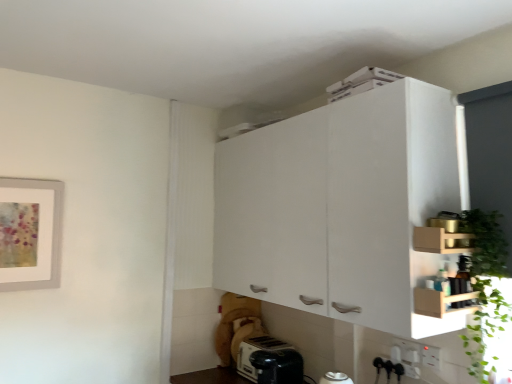
Question: Which direction should I rotate to face white matte cabinet at upper center, the first cabinetry positioned from the back, — up or down?

Choices:
 (A) down
 (B) up

Answer: (A)

Question: Is the depth of white plastic electric outlet at lower right, which appears as the 1th electric outlet when viewed from the back, less than that of wooden shelf at upper right, which is the 2th cabinetry from back to front?

Choices:
 (A) no
 (B) yes

Answer: (A)

Question: Can you confirm if white plastic electric outlet at lower right, which appears as the 1th electric outlet when viewed from the back, is smaller than wooden shelf at upper right, which is the 2th cabinetry from back to front?

Choices:
 (A) no
 (B) yes

Answer: (B)

Question: Considering the relative sizes of white plastic electric outlet at lower right, which ranks as the 2th electric outlet in right-to-left order, and wooden shelf at upper right, which is the 2th cabinetry from back to front, in the image provided, is white plastic electric outlet at lower right, which ranks as the 2th electric outlet in right-to-left order, bigger than wooden shelf at upper right, which is the 2th cabinetry from back to front,?

Choices:
 (A) no
 (B) yes

Answer: (A)

Question: From a real-world perspective, is white plastic electric outlet at lower right, which is the 2th electric outlet from front to back, over wooden shelf at upper right, arranged as the 1th cabinetry when viewed from the front?

Choices:
 (A) no
 (B) yes

Answer: (A)

Question: Does white plastic electric outlet at lower right, acting as the 1th electric outlet starting from the left, have a greater width compared to wooden shelf at upper right, which is the 2th cabinetry from back to front?

Choices:
 (A) no
 (B) yes

Answer: (A)

Question: Is white plastic electric outlet at lower right, which is the 2th electric outlet from front to back, outside of wooden shelf at upper right, arranged as the 1th cabinetry when viewed from the front?

Choices:
 (A) yes
 (B) no

Answer: (A)

Question: Is white plastic electric outlet at lower right, positioned as the second electric outlet in back-to-front order, far from white matte cabinet at upper center, which is the 2th cabinetry in front-to-back order?

Choices:
 (A) yes
 (B) no

Answer: (B)

Question: From a real-world perspective, is white plastic electric outlet at lower right, the 1th electric outlet in the front-to-back sequence, physically below white matte cabinet at upper center, the first cabinetry positioned from the back?

Choices:
 (A) yes
 (B) no

Answer: (A)

Question: Is white plastic electric outlet at lower right, the second electric outlet positioned from the left, bigger than white matte cabinet at upper center, which is the 2th cabinetry in front-to-back order?

Choices:
 (A) no
 (B) yes

Answer: (A)

Question: From the image's perspective, is white plastic electric outlet at lower right, placed as the 1th electric outlet when sorted from right to left, on top of white matte cabinet at upper center, which is the 2th cabinetry in front-to-back order?

Choices:
 (A) no
 (B) yes

Answer: (A)

Question: From the image's perspective, does white plastic electric outlet at lower right, placed as the 1th electric outlet when sorted from right to left, appear lower than white matte cabinet at upper center, which is the 2th cabinetry in front-to-back order?

Choices:
 (A) no
 (B) yes

Answer: (B)

Question: From a real-world perspective, is white plastic electric outlet at lower right, placed as the 1th electric outlet when sorted from right to left, located higher than white matte cabinet at upper center, the first cabinetry positioned from the back?

Choices:
 (A) yes
 (B) no

Answer: (B)

Question: Is white plastic toaster at lower center far away from white plastic electric outlet at lower right, which appears as the 1th electric outlet when viewed from the back?

Choices:
 (A) yes
 (B) no

Answer: (B)